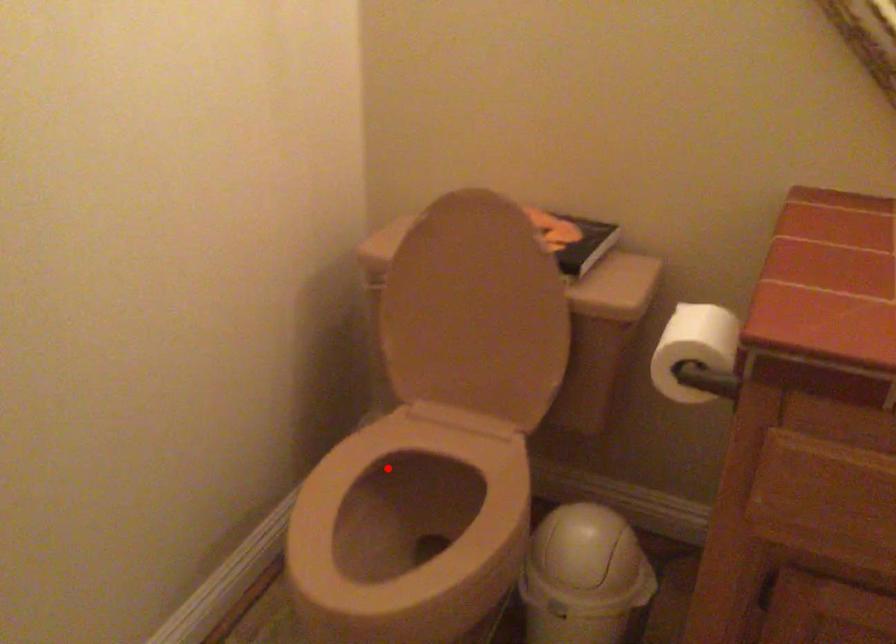
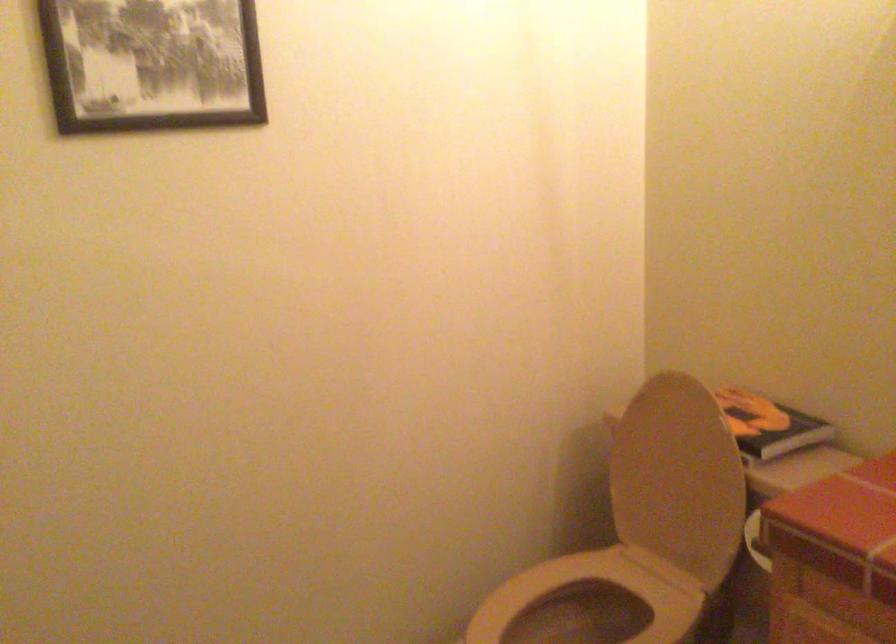
Question: I am providing you with two images of the same scene from different viewpoints. Image1 has a red point marked. In image2, the corresponding 3D location appears at what relative position? Reply with the corresponding letter.

Choices:
 (A) Closer
 (B) Farther

Answer: (B)